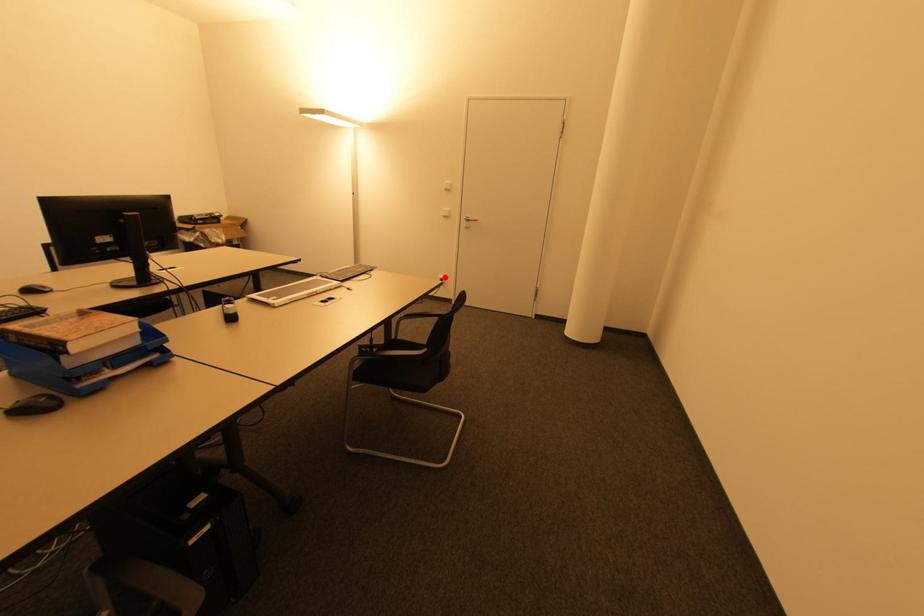
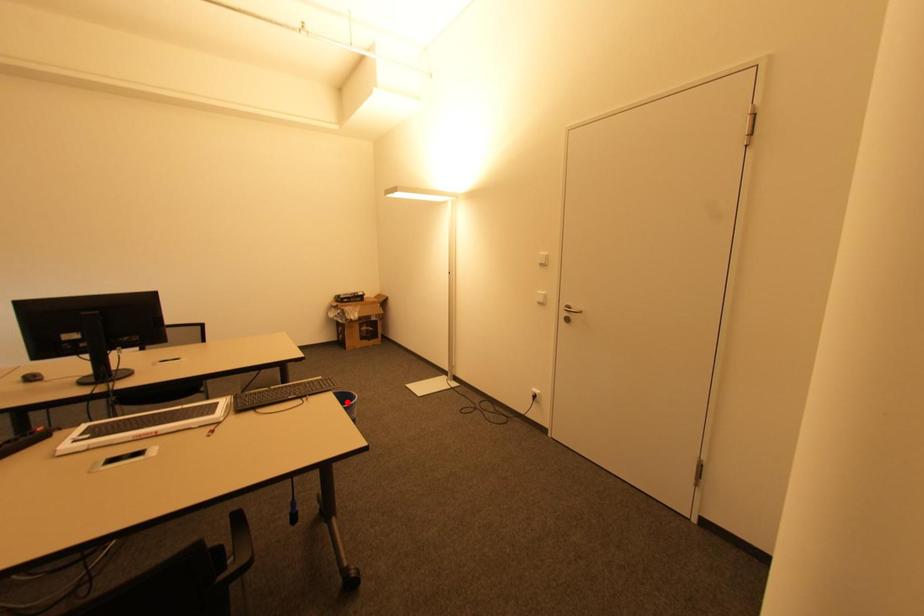
I am providing you with two images of the same scene from different viewpoints. A red point is marked on the first image and another point is marked on the second image. Are the points marked in image1 and image2 representing the same 3D position?

No